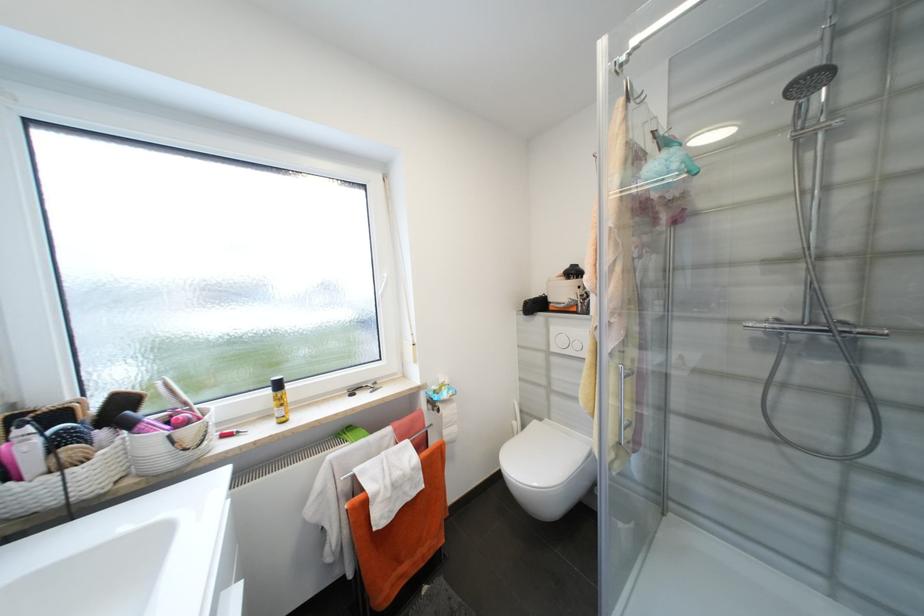
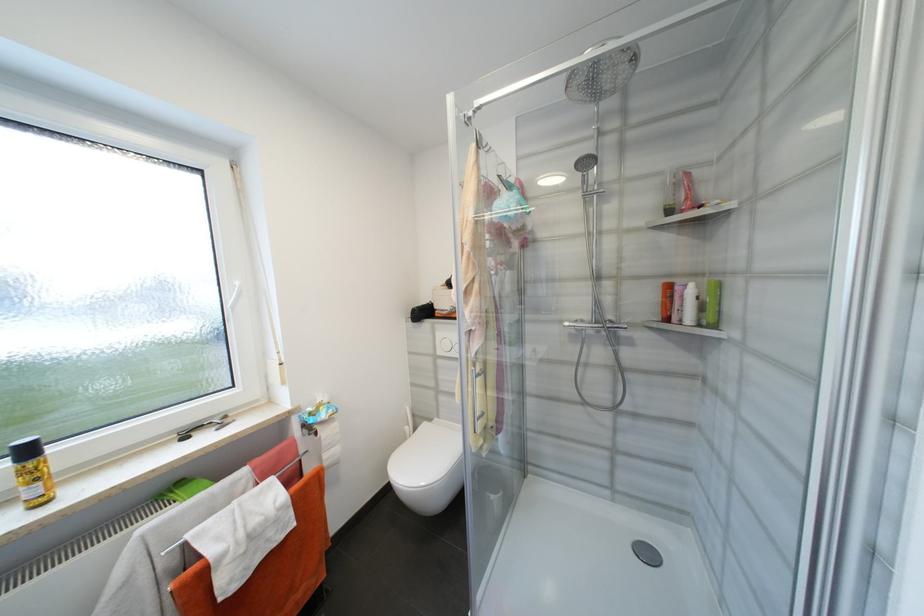
In the second image, find the point that corresponds to pixel 529 427 in the first image.

(420, 431)